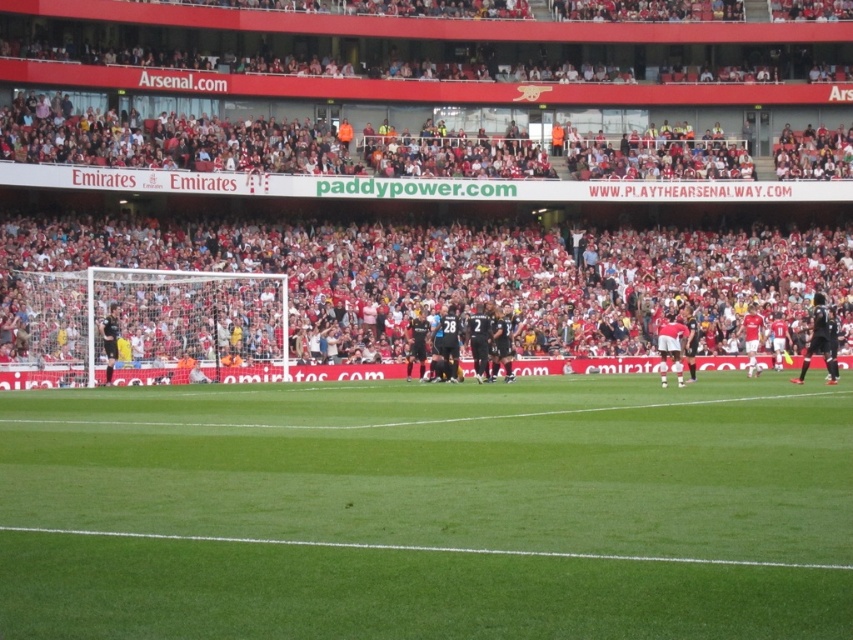
You are a photographer positioned at the edge of the field. You want to capture a photo that includes both the green grass at center and the black matte jersey at right. Which object should you focus on first if you want to ensure both are in frame without moving the camera?

The green grass at center should be focused on first since its width is greater than the black matte jersey at right, allowing it to dominate the frame while still including the jersey.

You are a photographer standing at the center of the stadium and want to take a photo of the two points marked in the image. Which point, point (682,372) or point (758,326), will appear larger in your photo?

Point (682,372) will appear larger in the photo because it is closer to the camera than point (758,326).